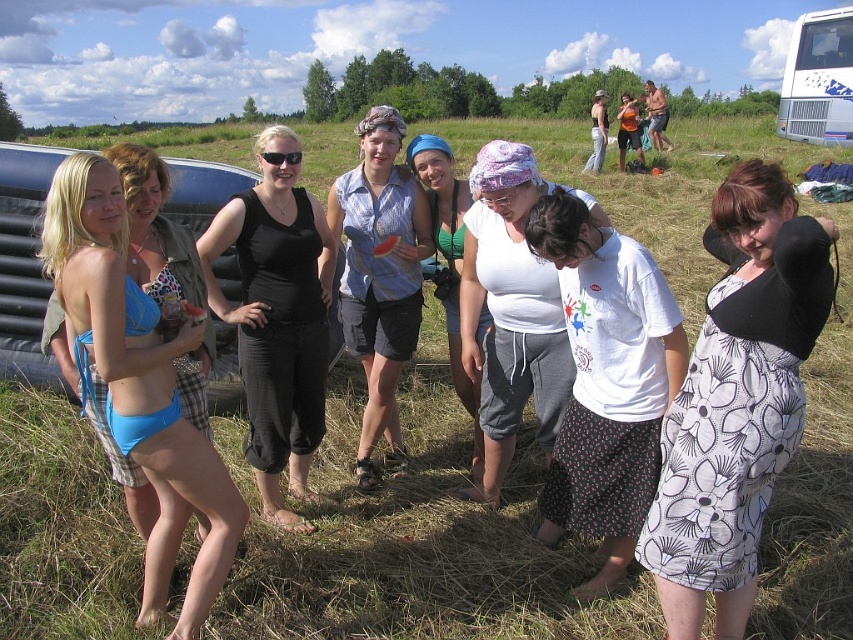
Question: Can you confirm if black matte tank top at left is positioned to the right of white metallic tour bus at upper right?

Choices:
 (A) yes
 (B) no

Answer: (B)

Question: Which point is closer to the camera?

Choices:
 (A) white cotton shirt at center
 (B) white cotton tank top at center

Answer: (B)

Question: Is white cotton tank top at center above white metallic tour bus at upper right?

Choices:
 (A) yes
 (B) no

Answer: (B)

Question: Is black matte tank top at left above white cotton shirt at center?

Choices:
 (A) yes
 (B) no

Answer: (B)

Question: Which of the following is the farthest from the observer?

Choices:
 (A) (456, 339)
 (B) (646, 353)
 (C) (793, 129)
 (D) (398, 371)

Answer: (C)

Question: Which of the following is the closest to the observer?

Choices:
 (A) (309, 339)
 (B) (552, 378)

Answer: (B)